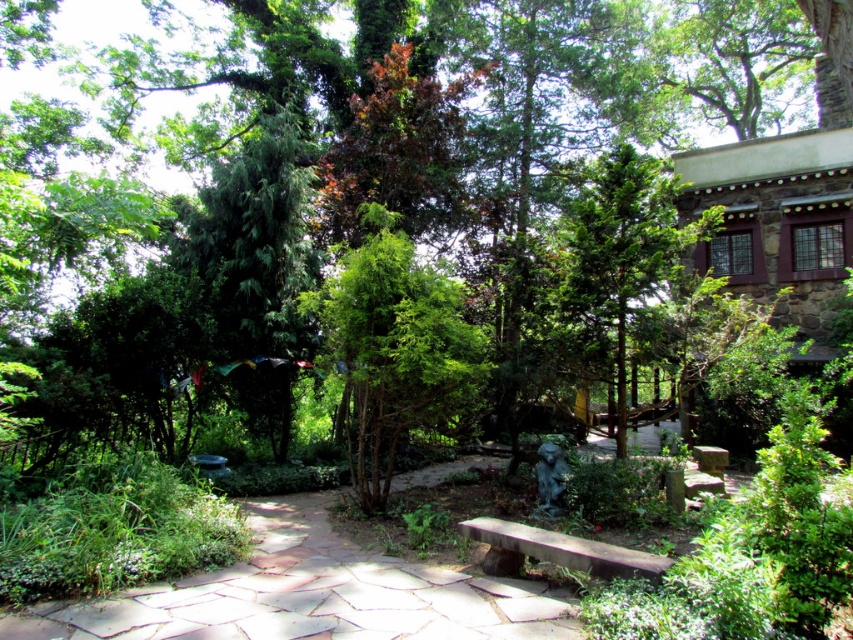
Who is shorter, green textured tree at center or green textured tree at upper left?

green textured tree at upper left

Who is positioned more to the right, green textured tree at center or green textured tree at upper left?

green textured tree at center

In order to click on green textured tree at center in this screenshot , I will do `click(393, 348)`.

Describe the element at coordinates (256, 241) in the screenshot. I see `green textured tree at upper left` at that location.

Does green textured tree at upper left have a lesser width compared to smooth stone bench at center?

Correct, green textured tree at upper left's width is less than smooth stone bench at center's.

Does point (236, 200) come behind point (662, 570)?

Yes, it is behind point (662, 570).

Where is `green textured tree at upper left`? green textured tree at upper left is located at coordinates (256, 241).

Is green textured tree at center thinner than green textured tree at upper center?

No, green textured tree at center is not thinner than green textured tree at upper center.

Between point (416, 387) and point (589, 369), which one is positioned behind?

The point (589, 369) is behind.

This screenshot has width=853, height=640. In order to click on green textured tree at center in this screenshot , I will do `click(393, 348)`.